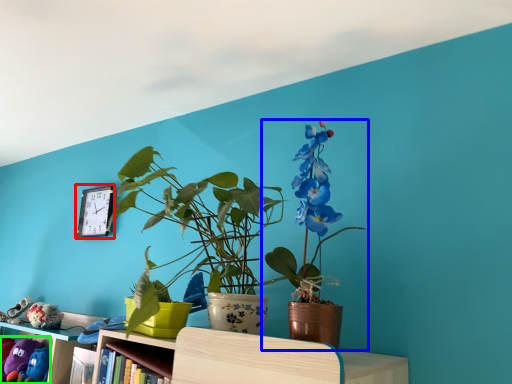
Question: Which object is positioned closest to clock (highlighted by a red box)? Select from houseplant (highlighted by a blue box) and toy (highlighted by a green box).

Choices:
 (A) houseplant
 (B) toy

Answer: (B)